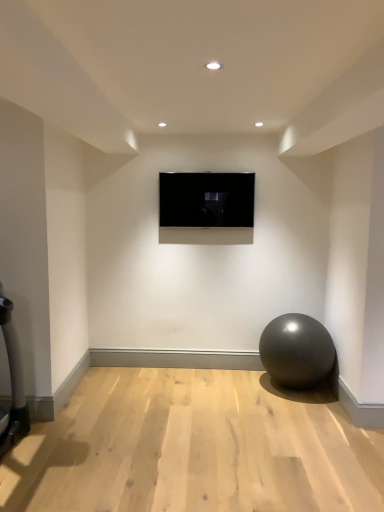
Question: Does matte gray ball at lower right have a greater height compared to matte black screen at center?

Choices:
 (A) no
 (B) yes

Answer: (B)

Question: Is matte gray ball at lower right positioned beyond the bounds of matte black screen at center?

Choices:
 (A) yes
 (B) no

Answer: (A)

Question: Does matte gray ball at lower right lie behind matte black screen at center?

Choices:
 (A) no
 (B) yes

Answer: (A)

Question: Would you say matte gray ball at lower right is a long distance from matte black screen at center?

Choices:
 (A) no
 (B) yes

Answer: (B)

Question: Is the position of matte gray ball at lower right less distant than that of matte black screen at center?

Choices:
 (A) yes
 (B) no

Answer: (A)

Question: From a real-world perspective, is matte gray ball at lower right physically above matte black screen at center?

Choices:
 (A) no
 (B) yes

Answer: (A)

Question: Could you tell me if matte black screen at center is turned towards matte gray ball at lower right?

Choices:
 (A) no
 (B) yes

Answer: (A)

Question: Considering the relative sizes of matte black screen at center and matte gray ball at lower right in the image provided, is matte black screen at center bigger than matte gray ball at lower right?

Choices:
 (A) yes
 (B) no

Answer: (B)

Question: Does matte black screen at center have a lesser height compared to matte gray ball at lower right?

Choices:
 (A) no
 (B) yes

Answer: (B)

Question: Is matte black screen at center not close to matte gray ball at lower right?

Choices:
 (A) no
 (B) yes

Answer: (B)

Question: From a real-world perspective, is matte black screen at center physically above matte gray ball at lower right?

Choices:
 (A) yes
 (B) no

Answer: (A)

Question: Can you confirm if matte black screen at center is thinner than matte gray ball at lower right?

Choices:
 (A) no
 (B) yes

Answer: (B)

Question: From their relative heights in the image, would you say matte gray ball at lower right is taller or shorter than matte black screen at center?

Choices:
 (A) tall
 (B) short

Answer: (A)